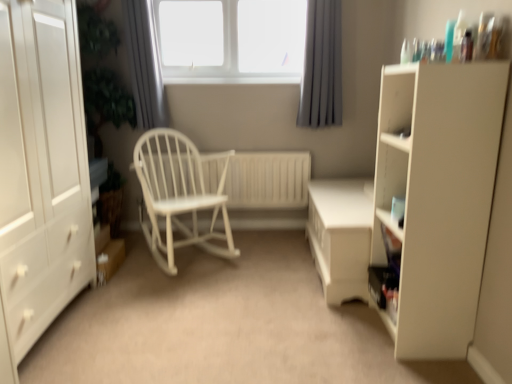
You are a GUI agent. You are given a task and a screenshot of the screen. Output one action in this format:
    pyautogui.click(x=<x>, y=<y>)
    Task: Click on the vacant region to the left of white glossy table at center
    The height and width of the screenshot is (384, 512).
    Given the screenshot: What is the action you would take?
    tap(261, 270)